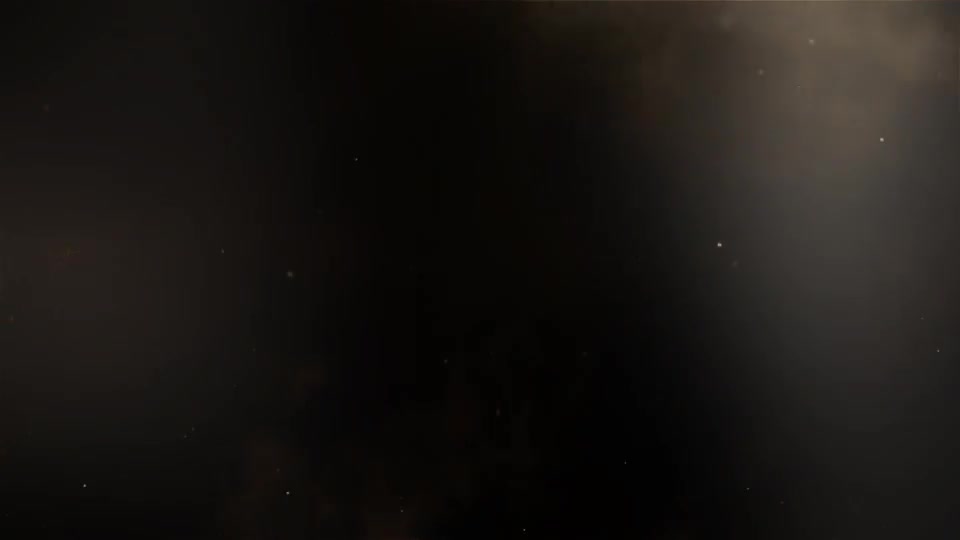
At what (x,y) coordinates should I click in order to perform the action: click on light. Please return your answer as a coordinate pair (x, y). The height and width of the screenshot is (540, 960). Looking at the image, I should click on (792, 112).